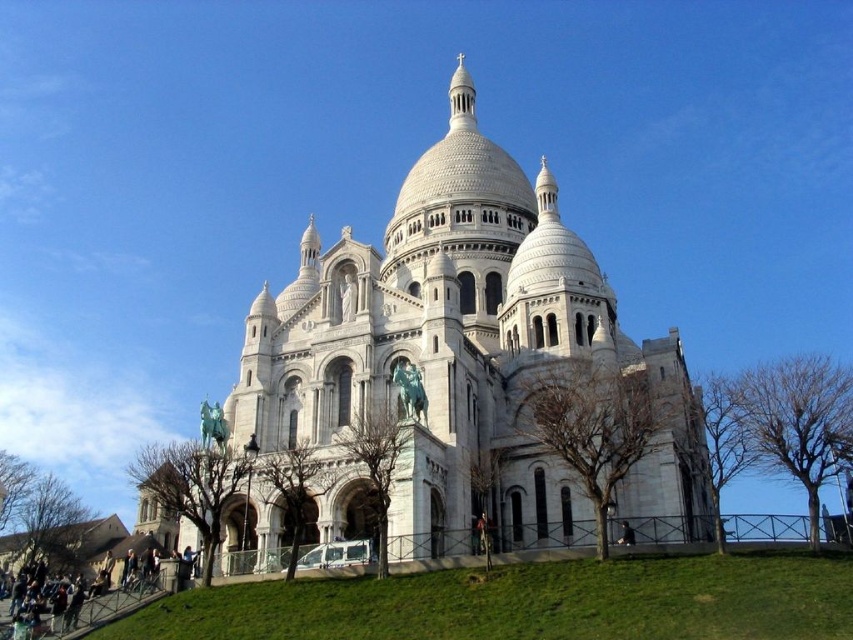
Can you confirm if white stone church at center is thinner than green grass at lower center?

No.

Who is more distant from viewer, (442, 339) or (204, 609)?

Point (442, 339)

Where is `white stone church at center`? white stone church at center is located at coordinates (459, 360).